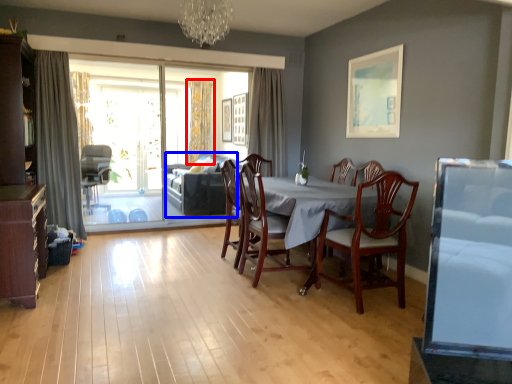
Question: Among these objects, which one is farthest to the camera, curtain (highlighted by a red box) or couch (highlighted by a blue box)?

Choices:
 (A) curtain
 (B) couch

Answer: (A)